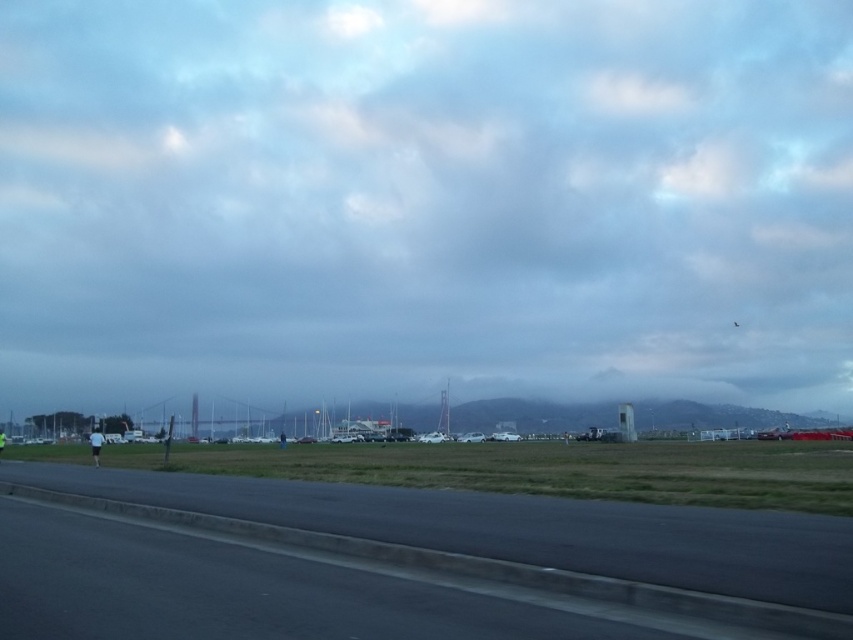
From the picture: Who is lower down, cloudy sky at upper center or black asphalt runway at lower left?

black asphalt runway at lower left is lower down.

Is cloudy sky at upper center above black asphalt runway at lower left?

Correct, cloudy sky at upper center is located above black asphalt runway at lower left.

This screenshot has height=640, width=853. Find the location of `cloudy sky at upper center`. cloudy sky at upper center is located at coordinates (424, 202).

This screenshot has height=640, width=853. Find the location of `cloudy sky at upper center`. cloudy sky at upper center is located at coordinates (424, 202).